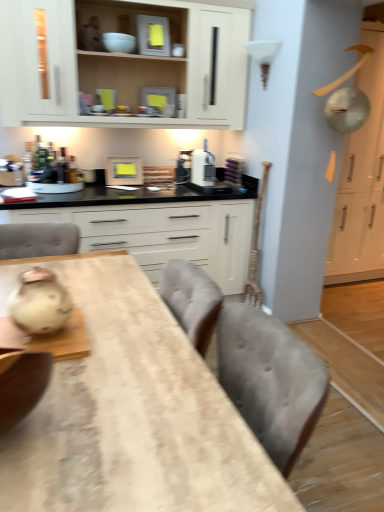
Question: Can you confirm if white matte cabinet at upper center, the 2th cabinetry when ordered from right to left, is bigger than matte white ceramic tea pot at left?

Choices:
 (A) yes
 (B) no

Answer: (A)

Question: Is white matte cabinet at upper center, which appears as the 2th cabinetry when viewed from the left, oriented away from matte white ceramic tea pot at left?

Choices:
 (A) no
 (B) yes

Answer: (A)

Question: Is matte white ceramic tea pot at left completely or partially inside white matte cabinet at upper center, which appears as the 2th cabinetry when viewed from the left?

Choices:
 (A) no
 (B) yes

Answer: (A)

Question: Can you confirm if white matte cabinet at upper center, the 2th cabinetry when ordered from right to left, is taller than matte white ceramic tea pot at left?

Choices:
 (A) yes
 (B) no

Answer: (A)

Question: From the image's perspective, would you say white matte cabinet at upper center, which appears as the 2th cabinetry when viewed from the left, is shown under matte white ceramic tea pot at left?

Choices:
 (A) yes
 (B) no

Answer: (B)

Question: Considering the relative sizes of white matte cabinet at upper center, which appears as the 2th cabinetry when viewed from the left, and matte white ceramic tea pot at left in the image provided, is white matte cabinet at upper center, which appears as the 2th cabinetry when viewed from the left, wider than matte white ceramic tea pot at left?

Choices:
 (A) yes
 (B) no

Answer: (A)

Question: Is wooden table at center to the right of white matte cabinet at upper center, the 2th cabinetry when ordered from right to left, from the viewer's perspective?

Choices:
 (A) no
 (B) yes

Answer: (B)

Question: Is wooden table at center at the left side of white matte cabinet at upper center, which appears as the 2th cabinetry when viewed from the left?

Choices:
 (A) yes
 (B) no

Answer: (B)

Question: Is wooden table at center next to white matte cabinet at upper center, the 2th cabinetry when ordered from right to left?

Choices:
 (A) no
 (B) yes

Answer: (A)

Question: Is wooden table at center positioned behind white matte cabinet at upper center, the 2th cabinetry when ordered from right to left?

Choices:
 (A) yes
 (B) no

Answer: (B)

Question: Does wooden table at center have a larger size compared to white matte cabinet at upper center, which appears as the 2th cabinetry when viewed from the left?

Choices:
 (A) yes
 (B) no

Answer: (A)

Question: Is wooden table at center positioned with its back to white matte cabinet at upper center, the 2th cabinetry when ordered from right to left?

Choices:
 (A) no
 (B) yes

Answer: (A)

Question: Can we say wooden table at center lies outside metallic silver toaster at upper center, which is counted as the 2th appliance, starting from the back?

Choices:
 (A) no
 (B) yes

Answer: (B)